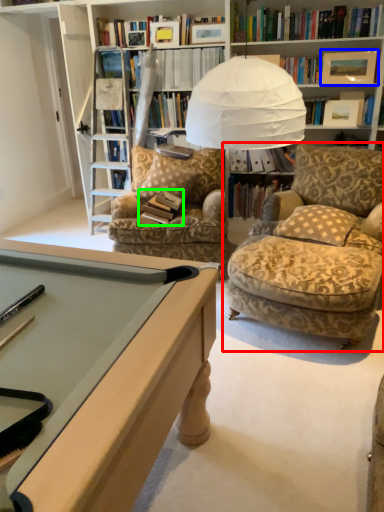
Question: Which is nearer to the chair (highlighted by a red box)? picture frame (highlighted by a blue box) or book (highlighted by a green box).

Choices:
 (A) picture frame
 (B) book

Answer: (B)